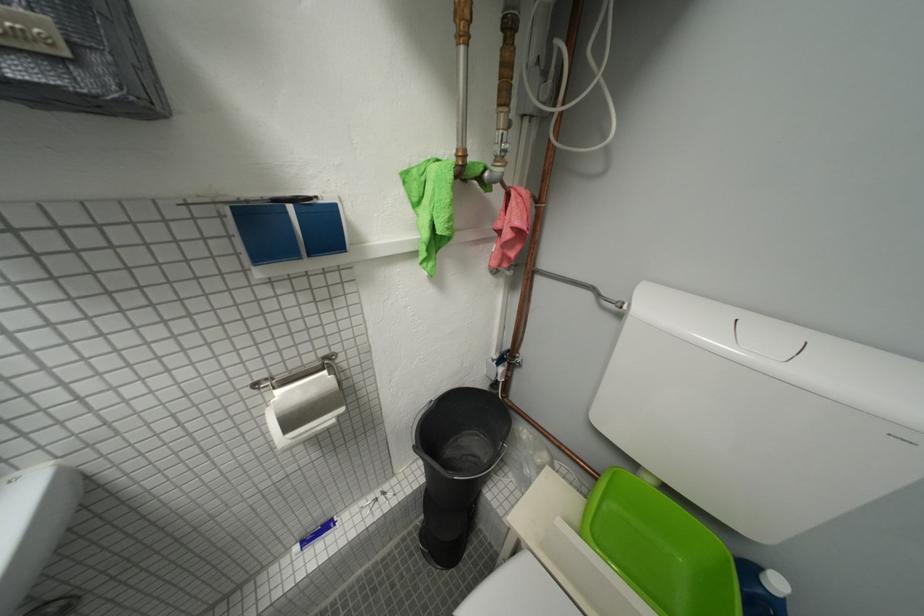
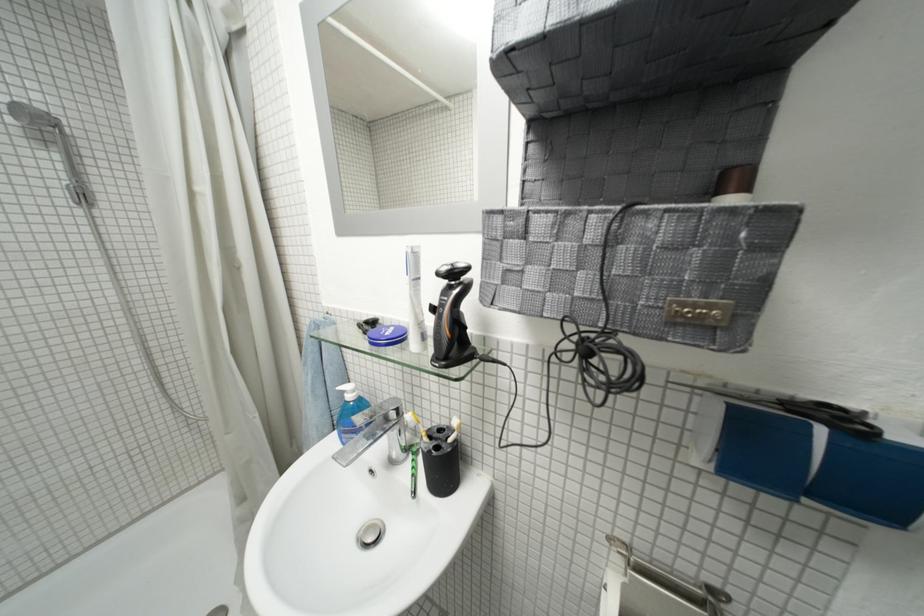
Question: How did the camera likely rotate?

Choices:
 (A) Left
 (B) Right
 (C) Up
 (D) Down

Answer: (A)